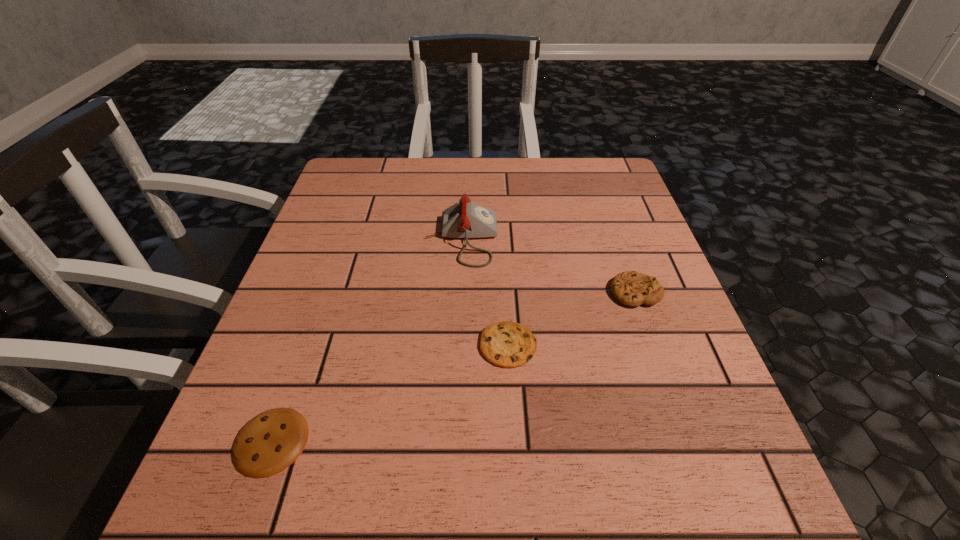
At what (x,y) coordinates should I click in order to perform the action: click on telephone. Please return your answer as a coordinate pair (x, y). Looking at the image, I should click on (465, 219).

I want to click on the farthest object, so click(x=465, y=219).

Identify the location of the rightmost cookie. (631, 288).

Where is `the second farthest object`? the second farthest object is located at coordinates (631, 288).

Locate an element on the screen. the second nearest object is located at coordinates (506, 344).

Locate an element on the screen. This screenshot has width=960, height=540. the second cookie from right to left is located at coordinates (506, 344).

Where is `the leftmost cookie`? the leftmost cookie is located at coordinates (267, 444).

Where is `the leftmost object`? Image resolution: width=960 pixels, height=540 pixels. the leftmost object is located at coordinates (267, 444).

Locate an element on the screen. The width and height of the screenshot is (960, 540). free space located on the dial of the telephone is located at coordinates (519, 239).

I want to click on vacant space situated 0.200m on the back of the third nearest object, so click(x=610, y=218).